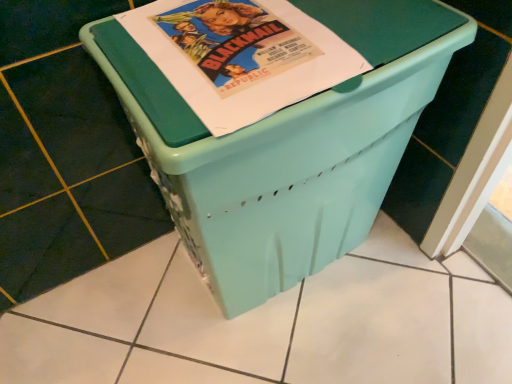
What is the approximate height of mint plastic bin at center?

It is 22.02 inches.

Where is `mint plastic bin at center`? This screenshot has height=384, width=512. mint plastic bin at center is located at coordinates (287, 147).

What do you see at coordinates (287, 147) in the screenshot? I see `mint plastic bin at center` at bounding box center [287, 147].

I want to click on mint plastic bin at center, so (287, 147).